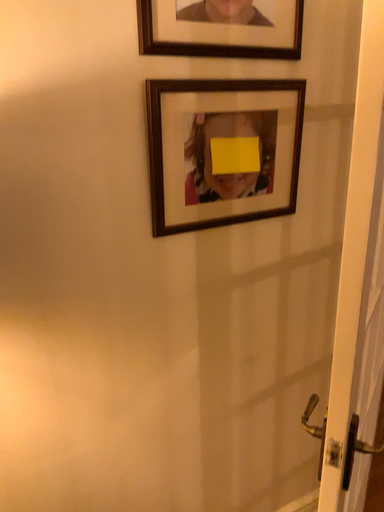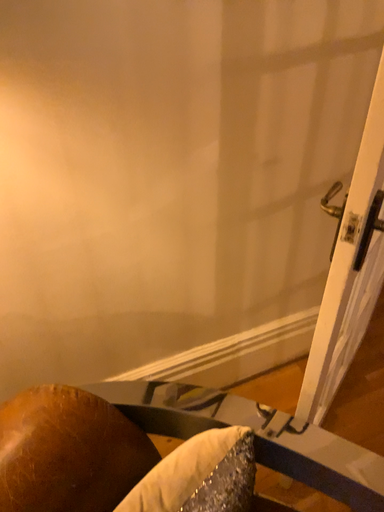
Question: Which way did the camera rotate in the video?

Choices:
 (A) rotated upward
 (B) rotated downward

Answer: (B)